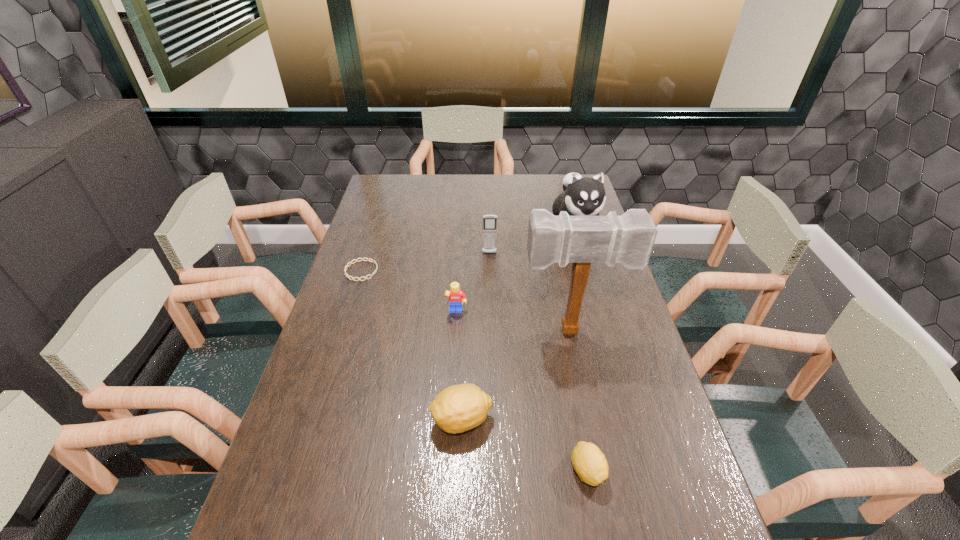
The width and height of the screenshot is (960, 540). Find the location of `object located at the far edge`. object located at the far edge is located at coordinates (582, 196).

Find the location of a particular element. Image resolution: width=960 pixels, height=540 pixels. object that is at the near edge is located at coordinates (590, 464).

I want to click on object located at the left edge, so click(x=369, y=259).

Where is `puppy that is at the right edge`? Image resolution: width=960 pixels, height=540 pixels. puppy that is at the right edge is located at coordinates (582, 196).

Where is `mallet located at the right edge`? The width and height of the screenshot is (960, 540). mallet located at the right edge is located at coordinates (628, 239).

The image size is (960, 540). Find the location of `object that is at the far right corner`. object that is at the far right corner is located at coordinates [582, 196].

Image resolution: width=960 pixels, height=540 pixels. In the image, there is a desktop. What are the coordinates of `free region at the far edge` in the screenshot? It's located at (546, 179).

The image size is (960, 540). In order to click on vacant space at the left edge of the desktop in this screenshot , I will do `click(390, 220)`.

The height and width of the screenshot is (540, 960). What are the coordinates of `vacant space at the right edge of the desktop` in the screenshot? It's located at (642, 346).

The image size is (960, 540). In the image, there is a desktop. Identify the location of vacant space at the far left corner. (390, 188).